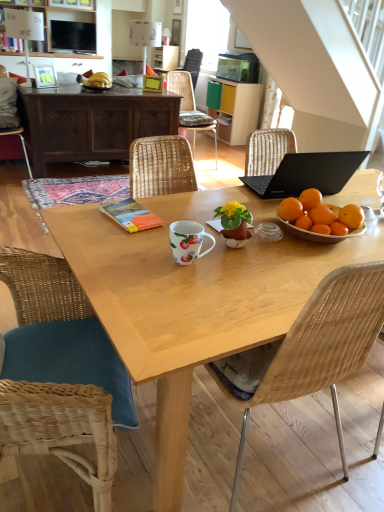
You are a GUI agent. You are given a task and a screenshot of the screen. Output one action in this format:
    pyautogui.click(x=<x>, y=<y>)
    Task: Click on the unoccupied region to the right of porcelain floral mug at center
    Image resolution: width=384 pixels, height=512 pixels.
    Given the screenshot: What is the action you would take?
    pyautogui.click(x=251, y=268)